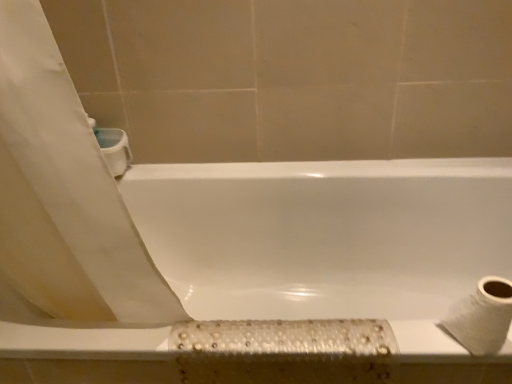
Question: From the image's perspective, is white glossy bathtub at center above or below white textured toilet paper at lower right?

Choices:
 (A) above
 (B) below

Answer: (B)

Question: From a real-world perspective, is white glossy bathtub at center physically located above or below white textured toilet paper at lower right?

Choices:
 (A) above
 (B) below

Answer: (B)

Question: Considering the positions of point (139, 225) and point (486, 283), is point (139, 225) closer or farther from the camera than point (486, 283)?

Choices:
 (A) farther
 (B) closer

Answer: (A)

Question: From the image's perspective, is white textured toilet paper at lower right above or below white glossy bathtub at center?

Choices:
 (A) above
 (B) below

Answer: (A)

Question: Considering the positions of white textured toilet paper at lower right and white glossy bathtub at center in the image, is white textured toilet paper at lower right wider or thinner than white glossy bathtub at center?

Choices:
 (A) thin
 (B) wide

Answer: (A)

Question: Considering the positions of white textured toilet paper at lower right and white glossy bathtub at center in the image, is white textured toilet paper at lower right taller or shorter than white glossy bathtub at center?

Choices:
 (A) short
 (B) tall

Answer: (A)

Question: Based on their sizes in the image, would you say white textured toilet paper at lower right is bigger or smaller than white glossy bathtub at center?

Choices:
 (A) big
 (B) small

Answer: (B)